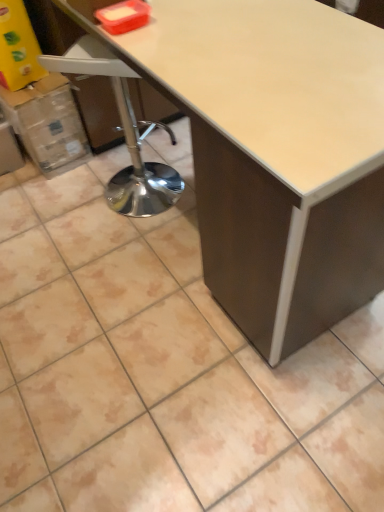
Image resolution: width=384 pixels, height=512 pixels. What are the coordinates of `free space in front of white plastic swivel chair at left` in the screenshot? It's located at (136, 245).